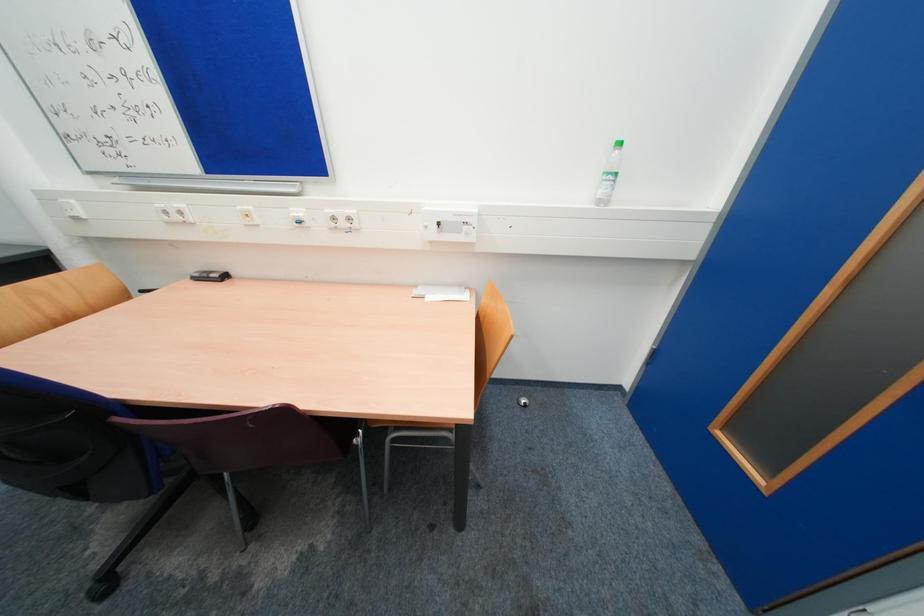
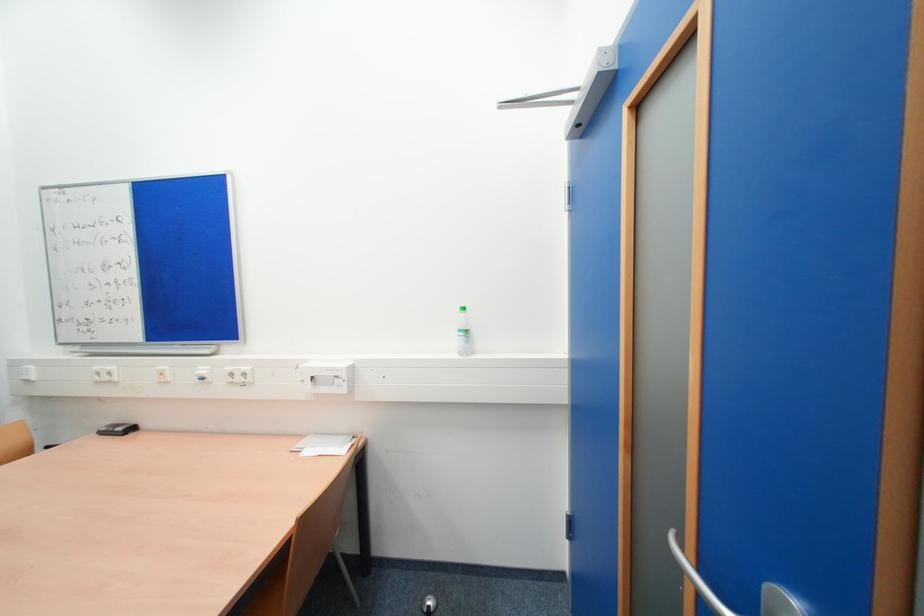
Question: The first image is from the beginning of the video and the second image is from the end. How did the camera likely rotate when shooting the video?

Choices:
 (A) Left
 (B) Right
 (C) Up
 (D) Down

Answer: (C)